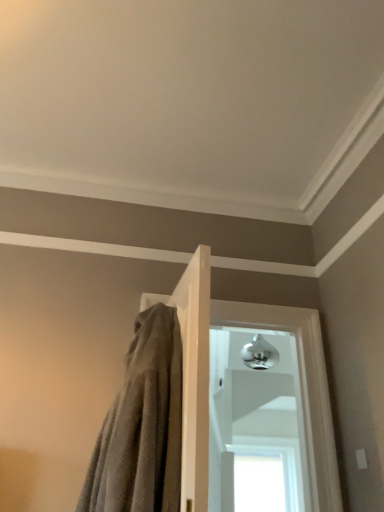
Identify the location of transparent glass window at center, positioned as the 2th window in top-to-bottom order. The image size is (384, 512). (258, 479).

Between polished chrome door handle at center, arranged as the first window when viewed from the top, and transparent glass window at center, positioned as the 2th window in top-to-bottom order, which one has larger width?

Wider between the two is polished chrome door handle at center, arranged as the first window when viewed from the top.

Which is nearer, (271, 440) or (223, 490)?

Point (271, 440) appears to be farther away from the viewer than point (223, 490).

Can you confirm if polished chrome door handle at center, arranged as the first window when viewed from the top, is shorter than transparent glass window at center, arranged as the 1th window when ordered from the bottom?

No, polished chrome door handle at center, arranged as the first window when viewed from the top, is not shorter than transparent glass window at center, arranged as the 1th window when ordered from the bottom.

From the image's perspective, which one is positioned higher, polished chrome door handle at center, the 2th window ordered from the bottom, or transparent glass window at center, positioned as the 2th window in top-to-bottom order?

From the image's view, polished chrome door handle at center, the 2th window ordered from the bottom, is above.

Is transparent glass window at center, arranged as the 1th window when ordered from the bottom, far from gray textured towel at center?

Yes, transparent glass window at center, arranged as the 1th window when ordered from the bottom, is far from gray textured towel at center.

Locate an element on the screen. This screenshot has width=384, height=512. the 2nd window counting from the right of the gray textured towel at center is located at coordinates 258,479.

Could you measure the distance between transparent glass window at center, positioned as the 2th window in top-to-bottom order, and gray textured towel at center?

transparent glass window at center, positioned as the 2th window in top-to-bottom order, and gray textured towel at center are 2.06 meters apart from each other.

How many degrees apart are the facing directions of transparent glass window at center, positioned as the 2th window in top-to-bottom order, and gray textured towel at center?

85 degrees.

Where is `window located behind the polished chrome door handle at center, the 2th window ordered from the bottom`? This screenshot has height=512, width=384. window located behind the polished chrome door handle at center, the 2th window ordered from the bottom is located at coordinates (258, 479).

From the image's perspective, between transparent glass window at center, arranged as the 1th window when ordered from the bottom, and polished chrome door handle at center, arranged as the first window when viewed from the top, which one is located above?

polished chrome door handle at center, arranged as the first window when viewed from the top, is shown above in the image.

Considering the relative positions of transparent glass window at center, positioned as the 2th window in top-to-bottom order, and polished chrome door handle at center, the 2th window ordered from the bottom, in the image provided, is transparent glass window at center, positioned as the 2th window in top-to-bottom order, to the left of polished chrome door handle at center, the 2th window ordered from the bottom, from the viewer's perspective?

Incorrect, transparent glass window at center, positioned as the 2th window in top-to-bottom order, is not on the left side of polished chrome door handle at center, the 2th window ordered from the bottom.

Is transparent glass window at center, positioned as the 2th window in top-to-bottom order, looking in the opposite direction of polished chrome door handle at center, the 2th window ordered from the bottom?

That's not correct — transparent glass window at center, positioned as the 2th window in top-to-bottom order, is not looking away from polished chrome door handle at center, the 2th window ordered from the bottom.

Does point (159, 318) appear closer or farther from the camera than point (225, 375)?

Point (159, 318) appears to be closer to the viewer than point (225, 375).

Where is `bath towel directly beneath the polished chrome door handle at center, arranged as the first window when viewed from the top (from a real-world perspective)`? bath towel directly beneath the polished chrome door handle at center, arranged as the first window when viewed from the top (from a real-world perspective) is located at coordinates (142, 425).

Does gray textured towel at center come in front of polished chrome door handle at center, the 2th window ordered from the bottom?

Yes, it is.

Can you confirm if polished chrome door handle at center, the 2th window ordered from the bottom, is bigger than gray textured towel at center?

Indeed, polished chrome door handle at center, the 2th window ordered from the bottom, has a larger size compared to gray textured towel at center.

Is polished chrome door handle at center, the 2th window ordered from the bottom, far away from gray textured towel at center?

Yes, polished chrome door handle at center, the 2th window ordered from the bottom, and gray textured towel at center are located far from each other.

What's the angular difference between polished chrome door handle at center, the 2th window ordered from the bottom, and gray textured towel at center's facing directions?

There is a 96.4-degree angle between the facing directions of polished chrome door handle at center, the 2th window ordered from the bottom, and gray textured towel at center.

Do you think polished chrome door handle at center, the 2th window ordered from the bottom, is within gray textured towel at center, or outside of it?

polished chrome door handle at center, the 2th window ordered from the bottom, exists outside the volume of gray textured towel at center.

Considering the relative positions of gray textured towel at center and transparent glass window at center, positioned as the 2th window in top-to-bottom order, in the image provided, is gray textured towel at center to the left of transparent glass window at center, positioned as the 2th window in top-to-bottom order, from the viewer's perspective?

Yes, gray textured towel at center is to the left of transparent glass window at center, positioned as the 2th window in top-to-bottom order.

From a real-world perspective, which object stands above the other?

gray textured towel at center, from a real-world perspective.

Between gray textured towel at center and transparent glass window at center, arranged as the 1th window when ordered from the bottom, which one has more height?

gray textured towel at center.

Considering the sizes of objects gray textured towel at center and transparent glass window at center, positioned as the 2th window in top-to-bottom order, in the image provided, who is bigger, gray textured towel at center or transparent glass window at center, positioned as the 2th window in top-to-bottom order,?

With larger size is gray textured towel at center.

Identify the location of window that is below the polished chrome door handle at center, arranged as the first window when viewed from the top (from the image's perspective). (258, 479).

In order to click on the 2nd window behind the gray textured towel at center in this screenshot , I will do `click(258, 479)`.

From the image, which object appears to be nearer to gray textured towel at center, polished chrome door handle at center, the 2th window ordered from the bottom, or transparent glass window at center, arranged as the 1th window when ordered from the bottom?

The object closer to gray textured towel at center is polished chrome door handle at center, the 2th window ordered from the bottom.

Considering their positions, is polished chrome door handle at center, the 2th window ordered from the bottom, positioned closer to transparent glass window at center, arranged as the 1th window when ordered from the bottom, than gray textured towel at center?

Based on the image, polished chrome door handle at center, the 2th window ordered from the bottom, appears to be nearer to transparent glass window at center, arranged as the 1th window when ordered from the bottom.

Estimate the real-world distances between objects in this image. Which object is further from polished chrome door handle at center, the 2th window ordered from the bottom, gray textured towel at center or transparent glass window at center, arranged as the 1th window when ordered from the bottom?

gray textured towel at center lies further to polished chrome door handle at center, the 2th window ordered from the bottom, than the other object.

When comparing their distances from polished chrome door handle at center, the 2th window ordered from the bottom, does transparent glass window at center, positioned as the 2th window in top-to-bottom order, or gray textured towel at center seem closer?

transparent glass window at center, positioned as the 2th window in top-to-bottom order, is closer to polished chrome door handle at center, the 2th window ordered from the bottom.

Based on the photo, when comparing their distances from gray textured towel at center, does transparent glass window at center, arranged as the 1th window when ordered from the bottom, or polished chrome door handle at center, arranged as the first window when viewed from the top, seem further?

transparent glass window at center, arranged as the 1th window when ordered from the bottom, is positioned further to the anchor gray textured towel at center.

Which object lies nearer to the anchor point transparent glass window at center, positioned as the 2th window in top-to-bottom order, gray textured towel at center or polished chrome door handle at center, the 2th window ordered from the bottom?

The object closer to transparent glass window at center, positioned as the 2th window in top-to-bottom order, is polished chrome door handle at center, the 2th window ordered from the bottom.

Find the location of a particular element. window positioned between gray textured towel at center and transparent glass window at center, arranged as the 1th window when ordered from the bottom, from near to far is located at coordinates (255, 426).